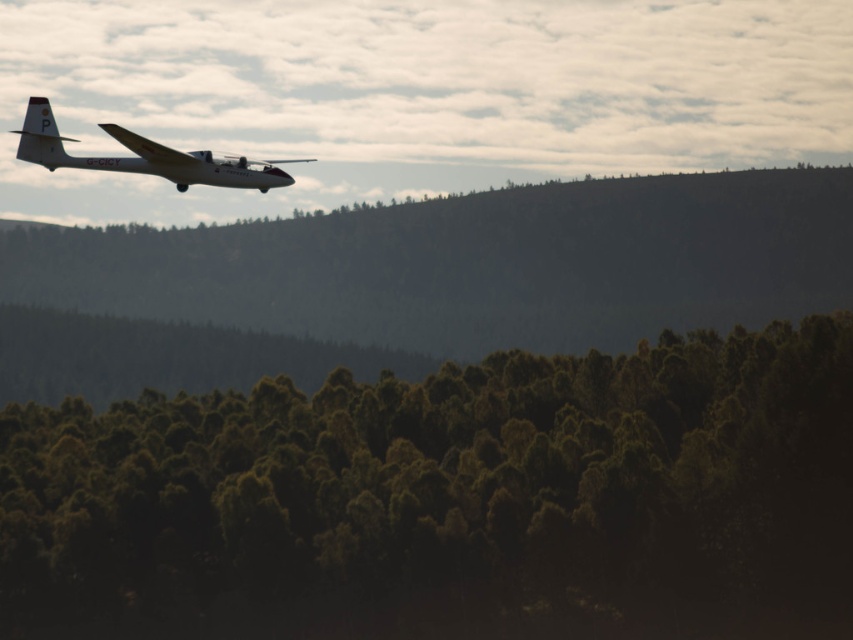
Which of these two, green textured trees at lower center or matte white airplane at upper left, stands taller?

Standing taller between the two is green textured trees at lower center.

Which is more to the left, green textured trees at lower center or matte white airplane at upper left?

matte white airplane at upper left is more to the left.

Is point (799, 339) positioned in front of point (136, 163)?

No, (799, 339) is further to viewer.

The width and height of the screenshot is (853, 640). I want to click on green textured trees at lower center, so click(445, 497).

Is point (735, 262) positioned before point (204, 177)?

No.

How distant is green textured hillside at upper center from matte white airplane at upper left?

They are 37.43 meters apart.

Who is more forward, (x=567, y=330) or (x=109, y=163)?

Positioned in front is point (x=109, y=163).

This screenshot has height=640, width=853. Find the location of `green textured hillside at upper center`. green textured hillside at upper center is located at coordinates point(419,282).

Which is above, green textured trees at lower center or green textured hillside at upper center?

green textured hillside at upper center

Is green textured trees at lower center below green textured hillside at upper center?

Indeed, green textured trees at lower center is positioned under green textured hillside at upper center.

Who is more distant from viewer, [67,465] or [326,253]?

Positioned behind is point [326,253].

The image size is (853, 640). I want to click on green textured trees at lower center, so click(x=445, y=497).